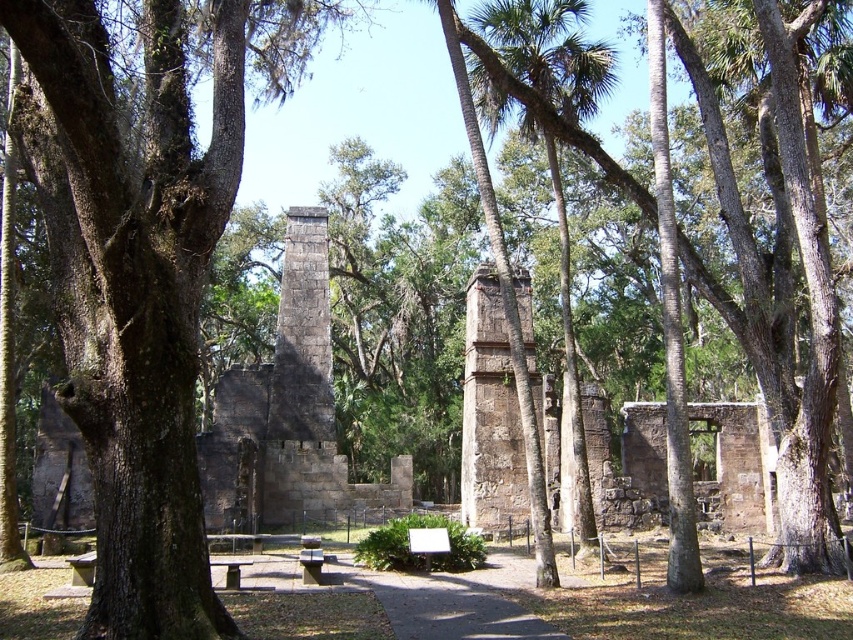
In the scene shown: Between green rough bark tree at left and stone ruins at center, which one has less height?

stone ruins at center is shorter.

Between green rough bark tree at left and stone ruins at center, which one is positioned lower?

stone ruins at center is below.

Does point (180, 211) come in front of point (318, 355)?

Yes.

Find the location of a particular element. green rough bark tree at left is located at coordinates (140, 276).